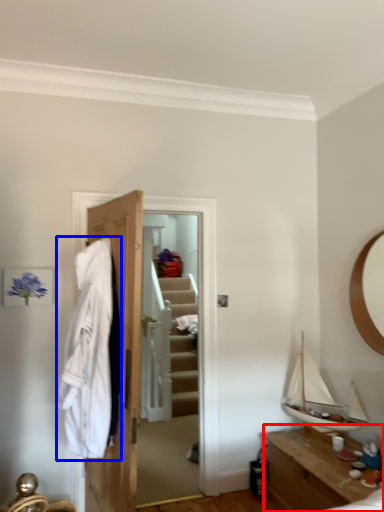
Question: Which object is further to the camera taking this photo, table (highlighted by a red box) or clothing (highlighted by a blue box)?

Choices:
 (A) table
 (B) clothing

Answer: (A)